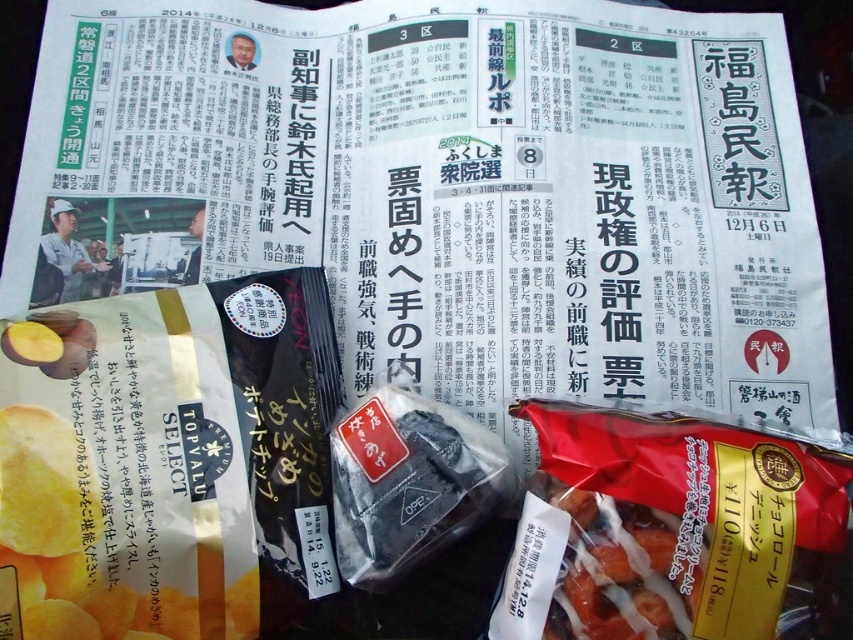
Question: Does black matte bag at center have a greater width compared to shiny brown snack at center?

Choices:
 (A) no
 (B) yes

Answer: (B)

Question: Which is farther from the yellow matte potato chips at lower left?

Choices:
 (A) shiny brown snack at center
 (B) black matte bag at center

Answer: (A)

Question: Is yellow matte potato chips at lower left wider than black matte bag at center?

Choices:
 (A) yes
 (B) no

Answer: (A)

Question: Does black matte bag at center have a smaller size compared to shiny brown snack at center?

Choices:
 (A) no
 (B) yes

Answer: (A)

Question: Among these objects, which one is farthest from the camera?

Choices:
 (A) yellow matte potato chips at lower left
 (B) shiny brown snack at center

Answer: (B)

Question: Which point is farther from the camera taking this photo?

Choices:
 (A) (390, 392)
 (B) (28, 474)

Answer: (A)